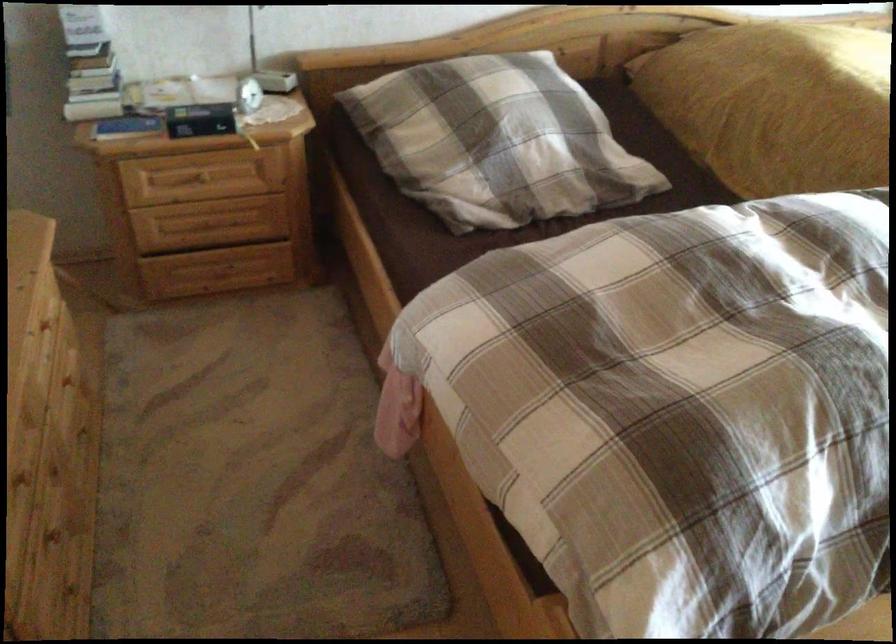
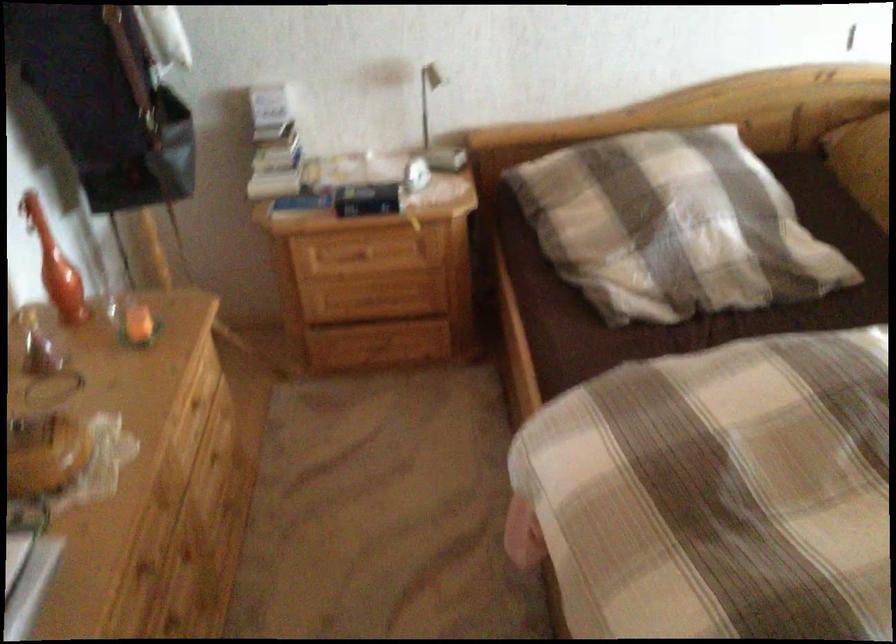
In the second image, find the point that corresponds to [507,144] in the first image.

(673, 225)